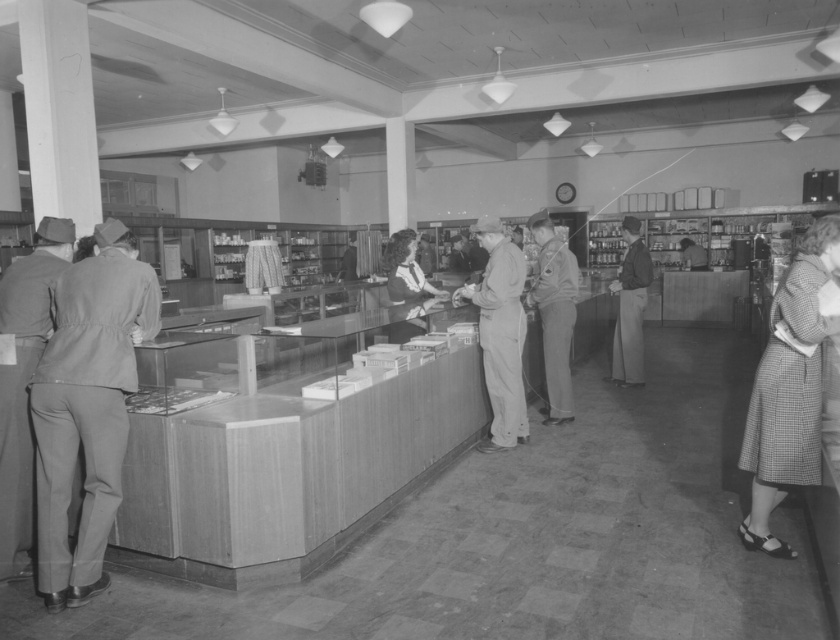
You are a customer in this store and you want to know which clothing item is shorter between the checkered fabric skirt at lower right and the dark gray uniform at center. Can you tell me?

The checkered fabric skirt at lower right has a lesser height compared to the dark gray uniform at center, so the checkered fabric skirt at lower right is shorter.

You are a customer in this store and you see the smooth gray suit at left and the uniformed man at center. Which object is located lower in the image?

The smooth gray suit at left is located lower than the uniformed man at center in the image.